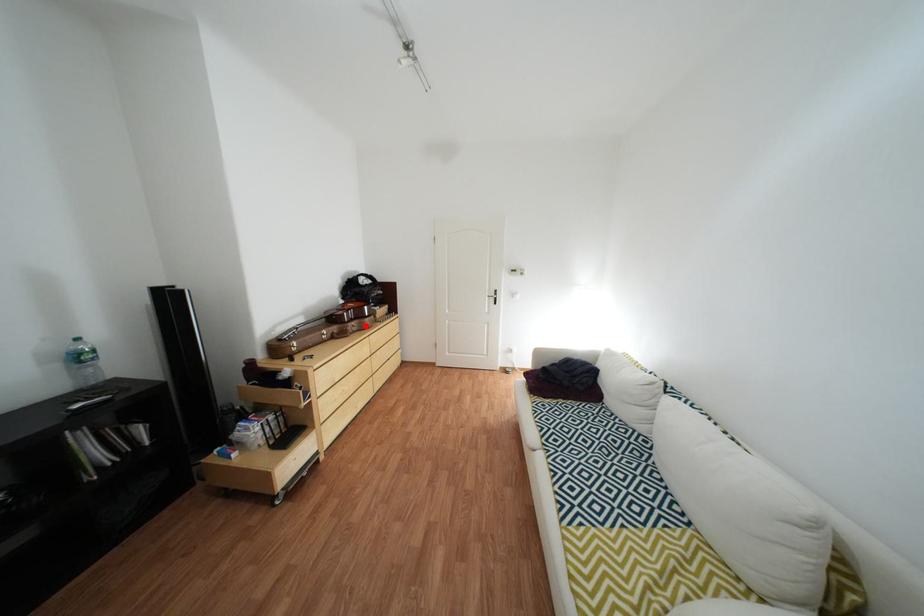
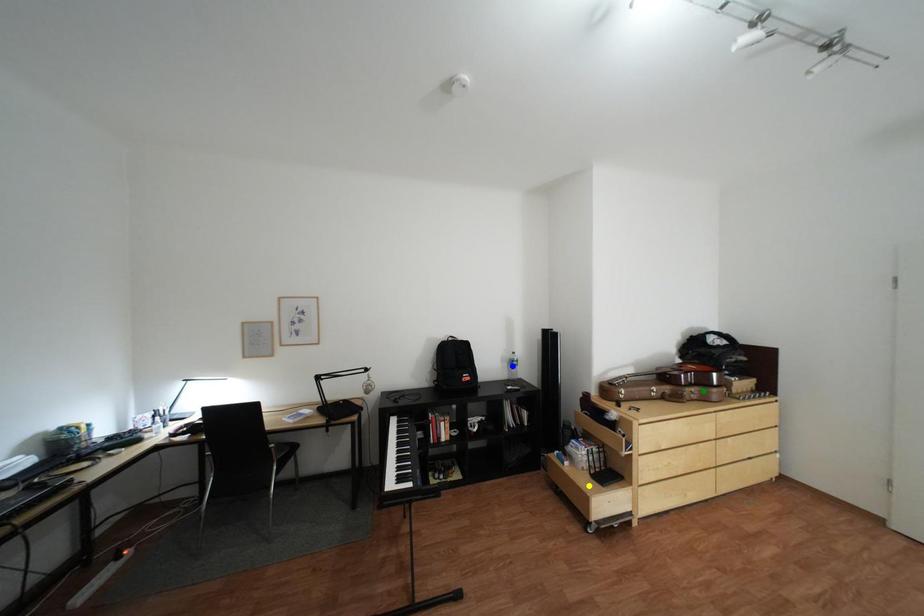
Question: I am providing you with two images of the same scene from different viewpoints. A red point is marked on the first image. You are given multiple points on the second image. Which spot in image 2 lines up with the point in image 1?

Choices:
 (A) blue point
 (B) green point
 (C) yellow point

Answer: (B)